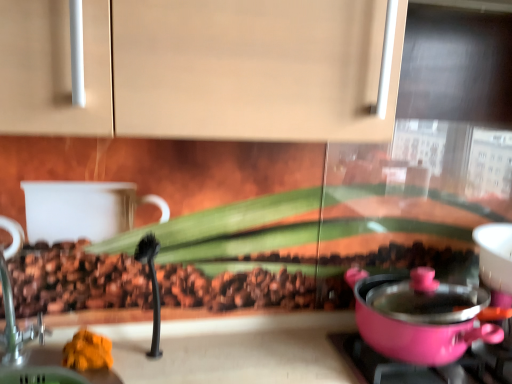
Question: Is pink plastic pot at lower right bigger or smaller than orange soft food at lower left?

Choices:
 (A) big
 (B) small

Answer: (A)

Question: In terms of height, does pink plastic pot at lower right look taller or shorter compared to orange soft food at lower left?

Choices:
 (A) short
 (B) tall

Answer: (B)

Question: Which object is positioned farthest from the brushed metal faucet at left?

Choices:
 (A) pink plastic pot at lower right
 (B) orange soft food at lower left
 (C) pink plastic pot at right

Answer: (C)

Question: Based on their relative distances, which object is nearer to the brushed metal faucet at left?

Choices:
 (A) pink plastic pot at lower right
 (B) pink plastic pot at right
 (C) orange soft food at lower left

Answer: (C)